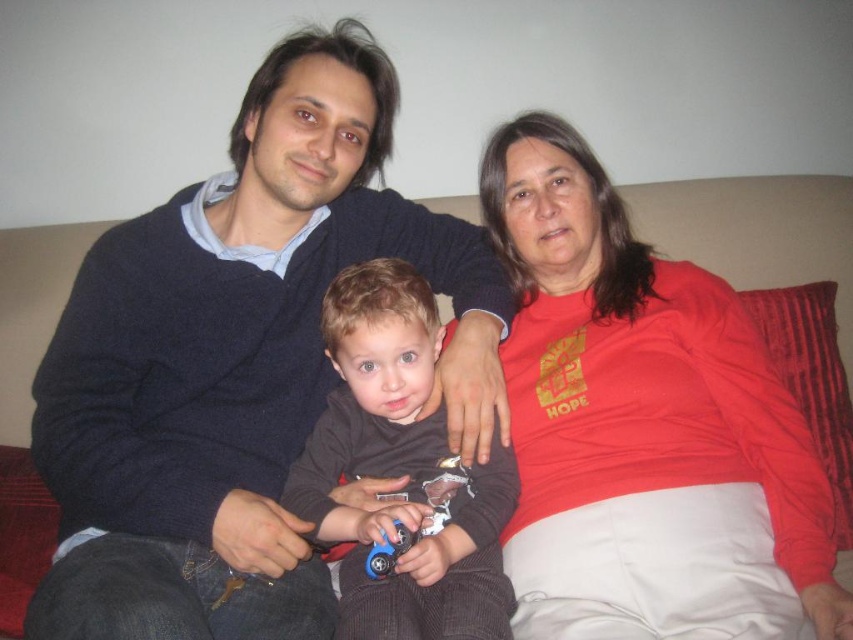
You are a photographer standing 30 inches away from the couch. You want to take a closeup shot of the matte dark blue sweater at center. Can you reach the sweater without moving closer than your current position?

The matte dark blue sweater at center is 31.48 inches from the viewer. Since you are currently 30 inches away, you need to move 1.48 inches closer to reach it.

You are a photographer standing 40 inches away from the couch. You want to take a closeup photo of the red matte shirt at center. Can you focus on it without moving closer?

The red matte shirt at center is 36.25 inches away from the viewer. Since you are standing 40 inches away, you are 3.75 inches too far to focus on it without moving closer.